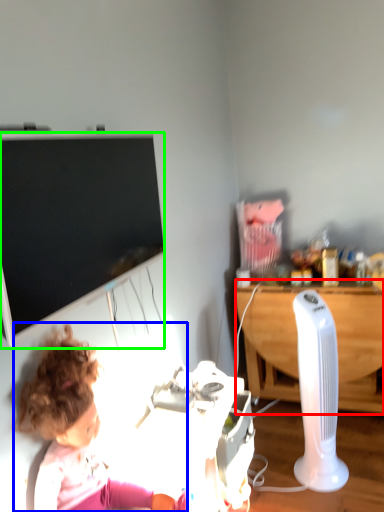
Question: Which object is the closest to the desk (highlighted by a red box)? Choose among these: person (highlighted by a blue box) or television (highlighted by a green box).

Choices:
 (A) person
 (B) television

Answer: (B)